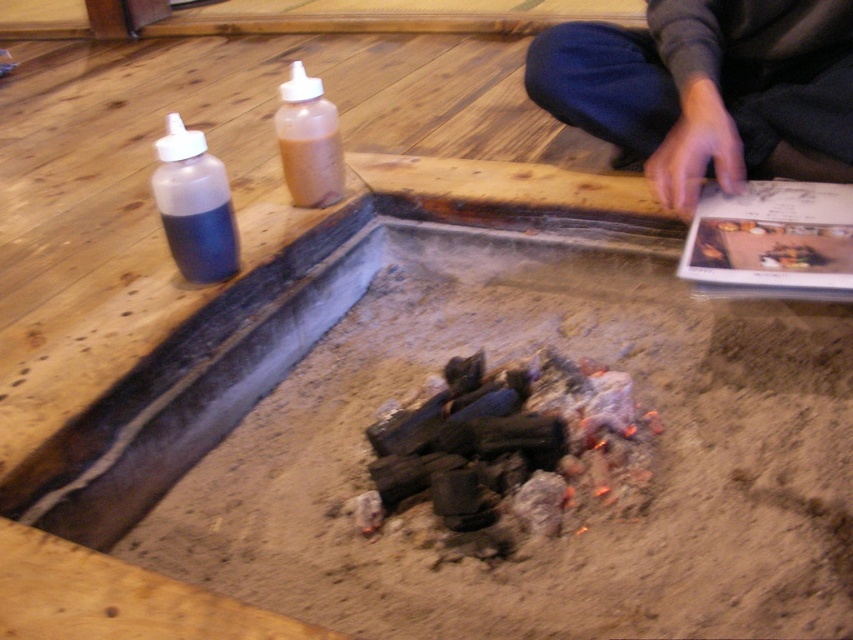
Between point (701, 74) and point (308, 179), which one is positioned behind?

Positioned behind is point (308, 179).

Who is more distant from viewer, (665, 170) or (303, 157)?

The point (303, 157) is more distant.

Image resolution: width=853 pixels, height=640 pixels. What are the coordinates of `dark gray sweater at upper right` in the screenshot? It's located at (708, 90).

How distant is transparent plastic bottle at left from translucent plastic bottle at center?

11.29 inches

Is point (160, 148) positioned in front of point (310, 120)?

Yes, point (160, 148) is in front of point (310, 120).

In order to click on transparent plastic bottle at left in this screenshot , I will do `click(194, 205)`.

Can you confirm if dark gray sweater at upper right is taller than transparent plastic bottle at left?

Yes.

Can you confirm if dark gray sweater at upper right is wider than transparent plastic bottle at left?

Yes.

Where is `dark gray sweater at upper right`? dark gray sweater at upper right is located at coordinates (708, 90).